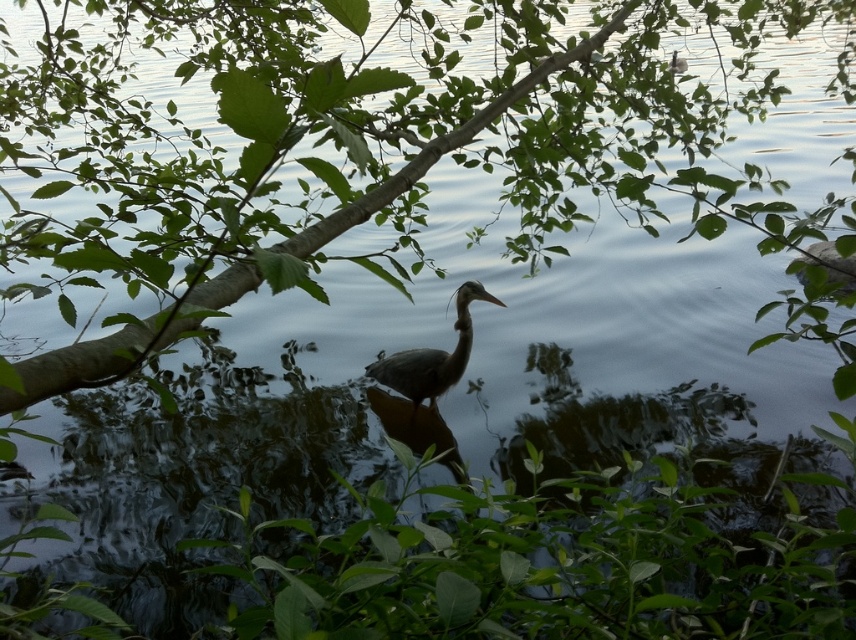
Question: Is green leafy plant at lower center smaller than gray matte heron at center?

Choices:
 (A) no
 (B) yes

Answer: (A)

Question: Does green leafy plant at lower center appear on the right side of gray matte heron at center?

Choices:
 (A) yes
 (B) no

Answer: (A)

Question: Is green leafy plant at lower center wider than gray matte heron at center?

Choices:
 (A) no
 (B) yes

Answer: (B)

Question: Which object appears farthest from the camera in this image?

Choices:
 (A) gray matte heron at center
 (B) green leafy plant at lower center

Answer: (A)

Question: Which of the following is the farthest from the observer?

Choices:
 (A) (312, 573)
 (B) (438, 368)

Answer: (B)